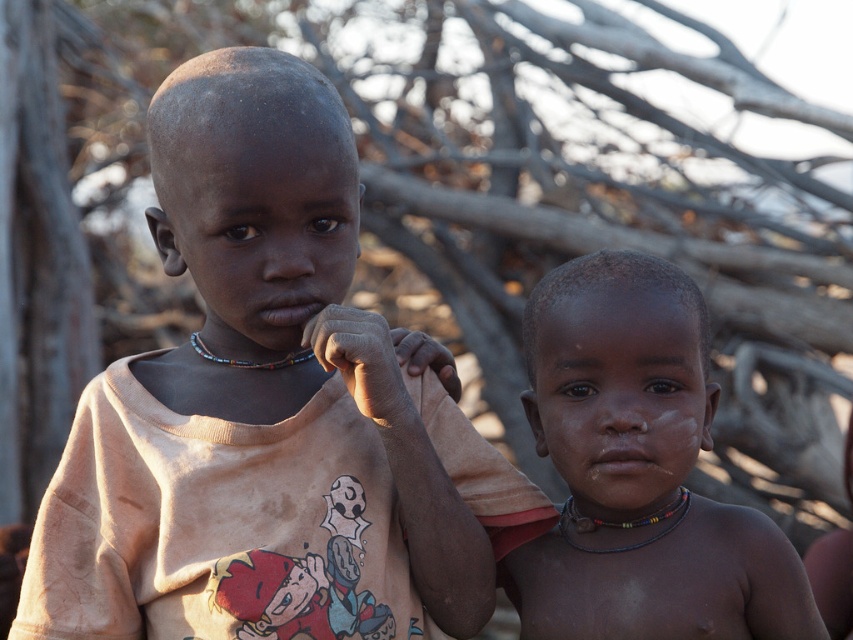
You are a photographer trying to capture a closeup of the child on the left. You have a camera with a focal length of 50mm. The point at coordinate point (258, 128) is on the child on the left, and the point at coordinate point (692, 330) is on the child on the right. Which point should you focus on to ensure the child on the left is in focus?

You should focus on point (258, 128) because it is closer to the viewer than point (692, 330), ensuring the child on the left is in focus.